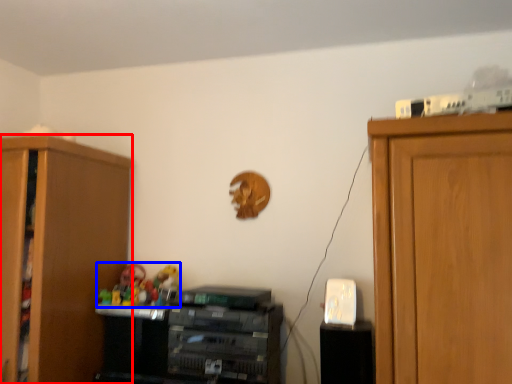
Question: Among these objects, which one is farthest to the camera, cabinetry (highlighted by a red box) or toy (highlighted by a blue box)?

Choices:
 (A) cabinetry
 (B) toy

Answer: (B)